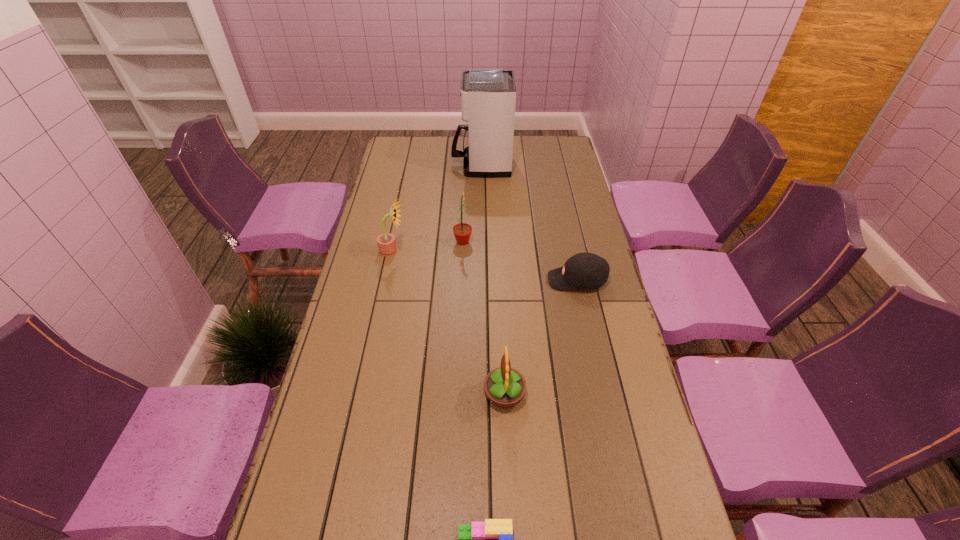
Where is `coffee maker`? coffee maker is located at coordinates (488, 96).

At what (x,y) coordinates should I click in order to perform the action: click on the tallest object. Please return your answer as a coordinate pair (x, y). Image resolution: width=960 pixels, height=540 pixels. Looking at the image, I should click on (488, 96).

The image size is (960, 540). What are the coordinates of `the second sunflower from right to left` in the screenshot? It's located at (462, 231).

Where is `the leftmost object`? the leftmost object is located at coordinates (386, 242).

Where is `the fifth farthest object`? the fifth farthest object is located at coordinates (505, 387).

The height and width of the screenshot is (540, 960). In order to click on the third shortest object in this screenshot , I will do `click(505, 387)`.

Where is `the rightmost object`? the rightmost object is located at coordinates (584, 270).

I want to click on the second shortest object, so click(x=584, y=270).

The width and height of the screenshot is (960, 540). What are the coordinates of `free space located on the front panel of the farthest object` in the screenshot? It's located at (392, 165).

Find the location of a particular element. The width and height of the screenshot is (960, 540). vacant point located 0.280m on the front panel of the farthest object is located at coordinates (390, 165).